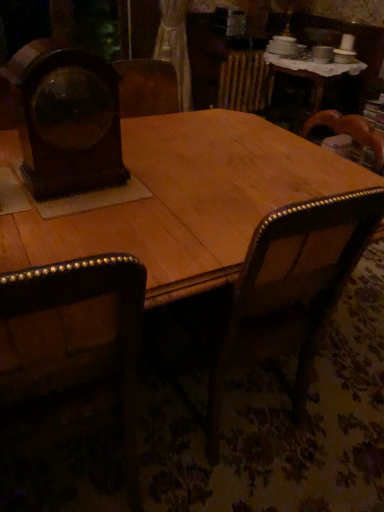
The width and height of the screenshot is (384, 512). Find the location of `wooden clock at left`. wooden clock at left is located at coordinates [71, 124].

What do you see at coordinates (73, 341) in the screenshot? The width and height of the screenshot is (384, 512). I see `dark brown leather chair at left` at bounding box center [73, 341].

Locate an element on the screen. The width and height of the screenshot is (384, 512). wooden armchair at center is located at coordinates (291, 289).

From the picture: Would you say wooden clock at left contains dark brown leather chair at left?

No, dark brown leather chair at left is not inside wooden clock at left.

Where is `clock above the dark brown leather chair at left (from a real-world perspective)`? This screenshot has width=384, height=512. clock above the dark brown leather chair at left (from a real-world perspective) is located at coordinates (71, 124).

Does wooden clock at left touch dark brown leather chair at left?

No, wooden clock at left is not making contact with dark brown leather chair at left.

Considering the sizes of objects wooden clock at left and dark brown leather chair at left in the image provided, who is shorter, wooden clock at left or dark brown leather chair at left?

Standing shorter between the two is wooden clock at left.

Based on their sizes in the image, would you say dark brown leather chair at left is bigger or smaller than wooden clock at left?

dark brown leather chair at left is bigger than wooden clock at left.

Looking at their sizes, would you say dark brown leather chair at left is wider or thinner than wooden clock at left?

In the image, dark brown leather chair at left appears to be wider than wooden clock at left.

What's the angular difference between dark brown leather chair at left and wooden clock at left's facing directions?

The angular difference between dark brown leather chair at left and wooden clock at left is 172 degrees.

Considering their positions, is dark brown leather chair at left located in front of or behind wooden clock at left?

dark brown leather chair at left is in front of wooden clock at left.

At what (x,y) coordinates should I click in order to perform the action: click on armchair on the right of wooden clock at left. Please return your answer as a coordinate pair (x, y). Looking at the image, I should click on (291, 289).

Considering the sizes of objects wooden clock at left and wooden armchair at center in the image provided, who is taller, wooden clock at left or wooden armchair at center?

wooden armchair at center.

Does wooden armchair at center come in front of dark brown leather chair at left?

No, it is not.

Based on their sizes in the image, would you say wooden armchair at center is bigger or smaller than dark brown leather chair at left?

Considering their sizes, wooden armchair at center takes up more space than dark brown leather chair at left.

Which object is positioned more to the left, wooden armchair at center or dark brown leather chair at left?

dark brown leather chair at left.

Is dark brown leather chair at left surrounded by wooden armchair at center?

Definitely not — dark brown leather chair at left is not inside wooden armchair at center.

Is point (329, 211) positioned in front of point (87, 114)?

Yes, it is in front of point (87, 114).

Which object is further away from the camera taking this photo, wooden armchair at center or wooden clock at left?

wooden clock at left is further away from the camera.

Is wooden armchair at center wider or thinner than wooden clock at left?

Clearly, wooden armchair at center has more width compared to wooden clock at left.

From a real-world perspective, is wooden armchair at center physically below wooden clock at left?

Yes, from a real-world perspective, wooden armchair at center is under wooden clock at left.

Are dark brown leather chair at left and wooden armchair at center far apart?

They are positioned close to each other.

The image size is (384, 512). What are the coordinates of `armchair on the right of dark brown leather chair at left` in the screenshot? It's located at (291, 289).

From a real-world perspective, who is located higher, dark brown leather chair at left or wooden armchair at center?

dark brown leather chair at left is physically above.

This screenshot has height=512, width=384. Find the location of `chair below the wooden clock at left (from a real-world perspective)`. chair below the wooden clock at left (from a real-world perspective) is located at coordinates (73, 341).

Where is `chair on the left of wooden clock at left`? chair on the left of wooden clock at left is located at coordinates (73, 341).

Which object lies nearer to the anchor point dark brown leather chair at left, wooden clock at left or wooden armchair at center?

The object closer to dark brown leather chair at left is wooden armchair at center.

Looking at the image, which one is located further to dark brown leather chair at left, wooden armchair at center or wooden clock at left?

wooden clock at left is positioned further to the anchor dark brown leather chair at left.

In the scene shown: When comparing their distances from wooden armchair at center, does dark brown leather chair at left or wooden clock at left seem closer?

Based on the image, dark brown leather chair at left appears to be nearer to wooden armchair at center.

From the image, which object appears to be farther from wooden clock at left, dark brown leather chair at left or wooden armchair at center?

wooden armchair at center.

When comparing their distances from wooden clock at left, does wooden armchair at center or dark brown leather chair at left seem further?

Based on the image, wooden armchair at center appears to be further to wooden clock at left.

Considering their positions, is wooden clock at left positioned further to wooden armchair at center than dark brown leather chair at left?

Among the two, wooden clock at left is located further to wooden armchair at center.

Locate an element on the screen. The width and height of the screenshot is (384, 512). armchair between wooden clock at left and dark brown leather chair at left in the up-down direction is located at coordinates [x=291, y=289].